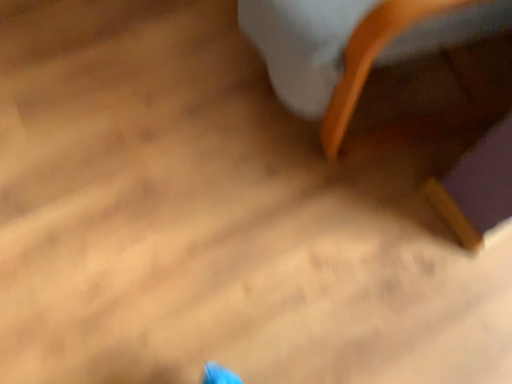
This screenshot has height=384, width=512. What are the coordinates of `orange fabric chair at upper right` in the screenshot? It's located at (402, 86).

Describe the element at coordinates (402, 86) in the screenshot. I see `orange fabric chair at upper right` at that location.

Where is `orange fabric chair at upper right`? orange fabric chair at upper right is located at coordinates (402, 86).